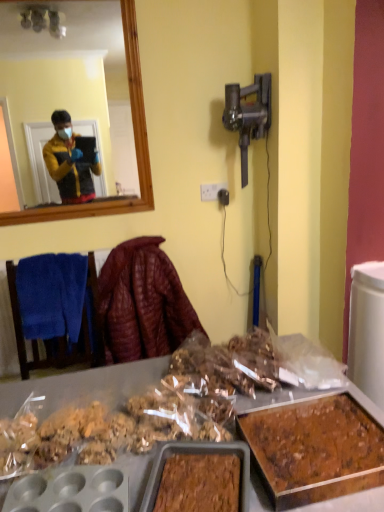
Question: Does brown crumbly cake at lower right have a larger size compared to white plastic power outlet at center?

Choices:
 (A) yes
 (B) no

Answer: (A)

Question: Can white plastic power outlet at center be found inside brown crumbly cake at lower right?

Choices:
 (A) no
 (B) yes

Answer: (A)

Question: Does brown crumbly cake at lower right turn towards white plastic power outlet at center?

Choices:
 (A) yes
 (B) no

Answer: (B)

Question: From the image's perspective, is brown crumbly cake at lower right over white plastic power outlet at center?

Choices:
 (A) no
 (B) yes

Answer: (A)

Question: Is brown crumbly cake at lower right completely or partially outside of white plastic power outlet at center?

Choices:
 (A) yes
 (B) no

Answer: (A)

Question: Considering the positions of point (342, 457) and point (56, 328), is point (342, 457) closer or farther from the camera than point (56, 328)?

Choices:
 (A) closer
 (B) farther

Answer: (A)

Question: Relative to blue towel at left, is brown crumbly cake at lower right in front or behind?

Choices:
 (A) front
 (B) behind

Answer: (A)

Question: From a real-world perspective, relative to blue towel at left, is brown crumbly cake at lower right vertically above or below?

Choices:
 (A) below
 (B) above

Answer: (A)

Question: From their relative heights in the image, would you say brown crumbly cake at lower right is taller or shorter than blue towel at left?

Choices:
 (A) short
 (B) tall

Answer: (A)

Question: Considering the positions of leather-like maroon jacket at center and blue towel at left in the image, is leather-like maroon jacket at center wider or thinner than blue towel at left?

Choices:
 (A) wide
 (B) thin

Answer: (A)

Question: In terms of size, does leather-like maroon jacket at center appear bigger or smaller than blue towel at left?

Choices:
 (A) small
 (B) big

Answer: (B)

Question: From their relative heights in the image, would you say leather-like maroon jacket at center is taller or shorter than blue towel at left?

Choices:
 (A) tall
 (B) short

Answer: (A)

Question: Is leather-like maroon jacket at center spatially inside blue towel at left, or outside of it?

Choices:
 (A) outside
 (B) inside

Answer: (A)

Question: Based on their sizes in the image, would you say white plastic power outlet at center is bigger or smaller than leather-like maroon jacket at center?

Choices:
 (A) small
 (B) big

Answer: (A)

Question: Would you say white plastic power outlet at center is to the left or to the right of leather-like maroon jacket at center in the picture?

Choices:
 (A) left
 (B) right

Answer: (B)